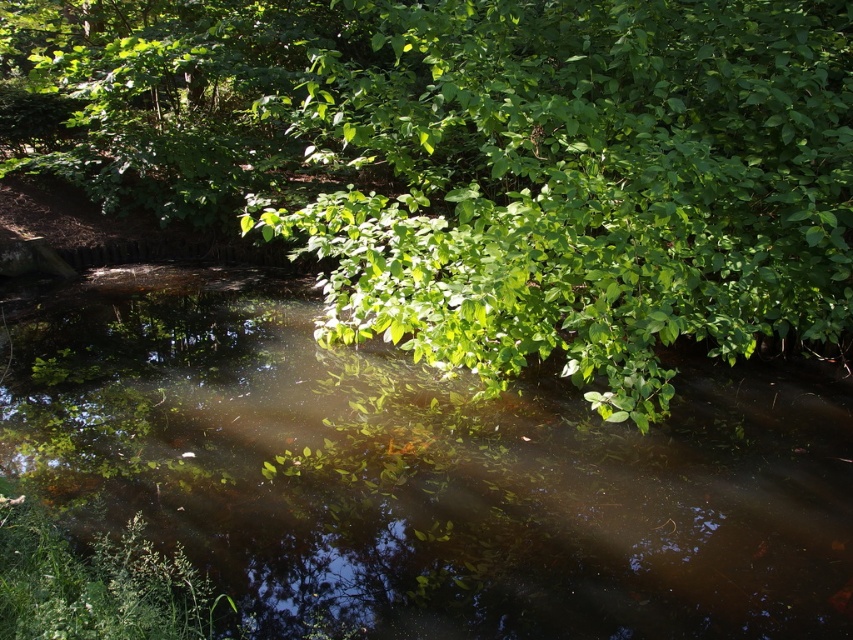
You are standing at the edge of the pond and notice the green leafy tree at center and the clear water at center. Which object is higher in position?

The green leafy tree at center is above clear water at center, so the green leafy tree at center is higher in position.

You are standing at the edge of the pond and see the green leafy tree at center and the clear water at center. Which object is shorter in height?

The green leafy tree at center is shorter than the clear water at center.